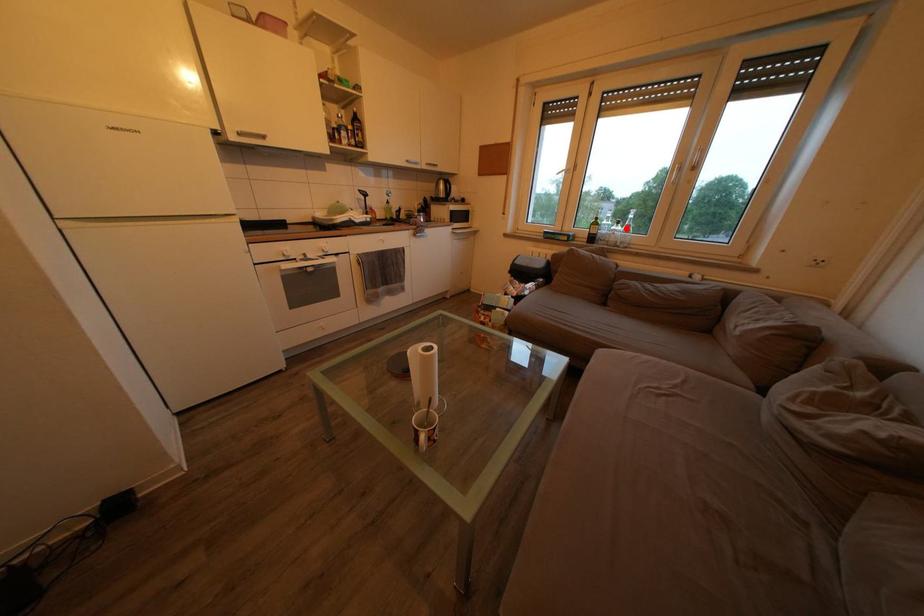
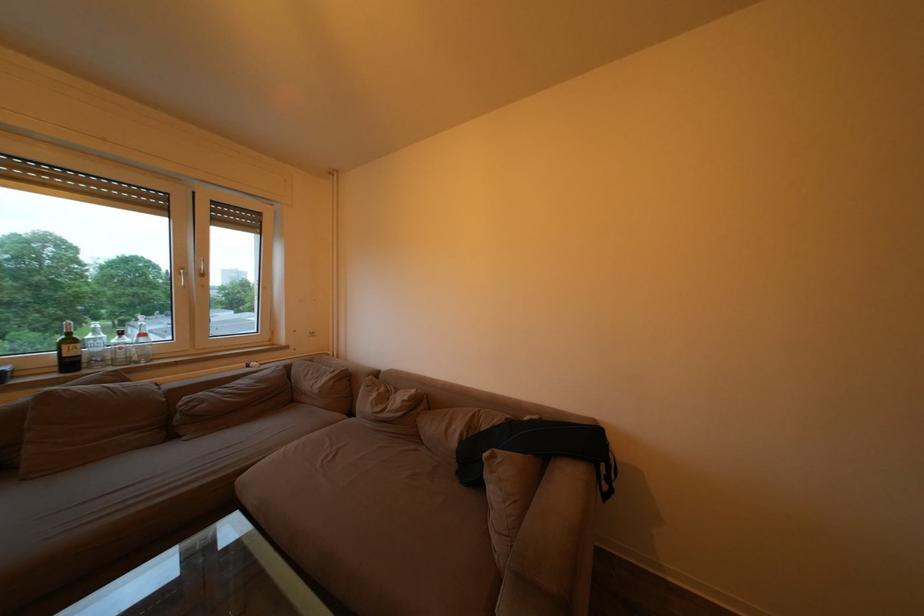
The point at the highlighted location is marked in the first image. Where is the corresponding point in the second image?

(129, 339)